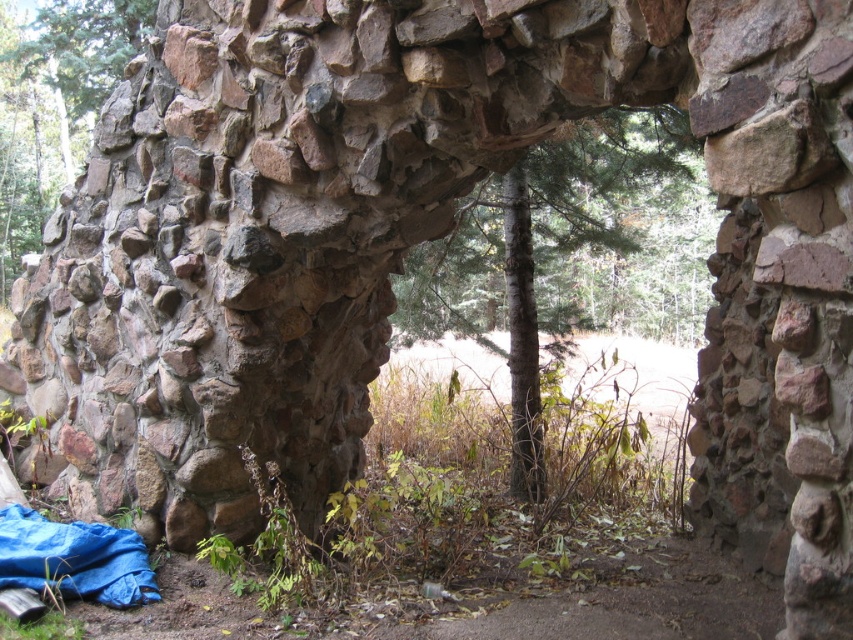
You are a painter standing at the base of the stone archway. You want to paint the green textured tree at center and the rustic stone wall at center. Which object should you step closer to in order to capture its details without needing to zoom in more?

The green textured tree at center is larger in size than the rustic stone wall at center, so you should step closer to the rustic stone wall at center to capture its details without needing to zoom in more.

From the picture: You are standing in front of the stone archway and want to take a photo of the green textured tree at center and the rustic stone wall at center. Which object will appear closer to the camera in the photo?

The green textured tree at center will appear closer to the camera in the photo because it is positioned in front of the rustic stone wall at center.